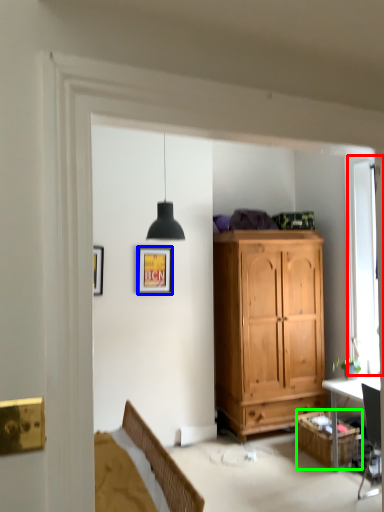
Question: Based on their relative distances, which object is farther from window (highlighted by a red box)? Choose from picture frame (highlighted by a blue box) and cabinetry (highlighted by a green box).

Choices:
 (A) picture frame
 (B) cabinetry

Answer: (A)